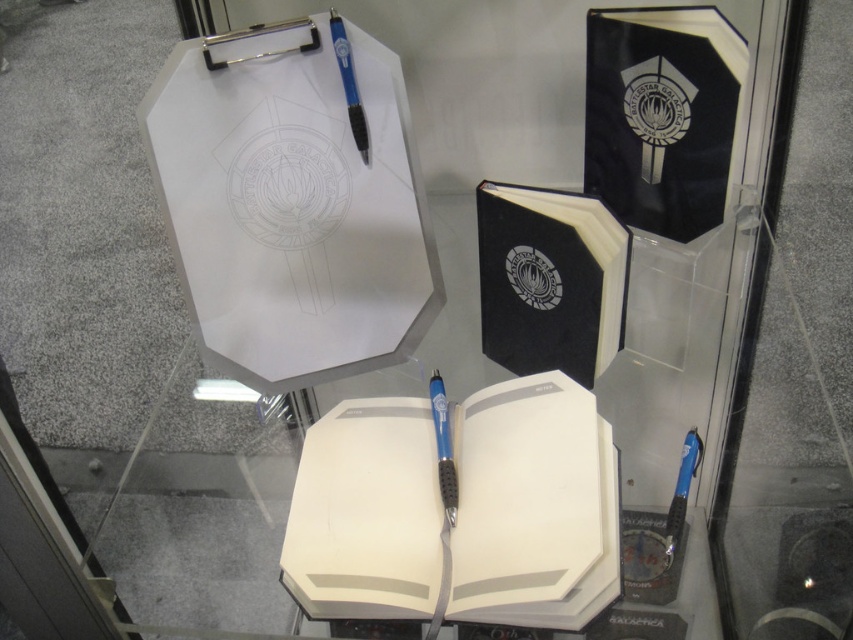
You are a museum visitor observing the Battlestar Galactica display. You notice the white matte notebook at center and the blue plastic pen at upper center. Which object is located higher in the display case?

The blue plastic pen at upper center is higher in the display case than the white matte notebook at center.

From the picture: You are a curator planning to rearrange the display. If you want to move the item at point (436,388) closer to the front of the display case, which direction should you move it relative to the item at point (364,125)?

The item at point (436,388) is currently behind the item at point (364,125). To move it closer to the front, you should move it forward so that it is in front of the item at point (364,125).

You are an archivist organizing items in the Battlestar Galactica display case. You need to place a new item between the white matte notebook at center and the blue plastic pen at upper center. Considering their sizes, which item should go on the bottom to ensure stability?

The white matte notebook at center is much taller than the blue plastic pen at upper center, so placing the notebook at the bottom would provide a stable base for the pen to sit on top.